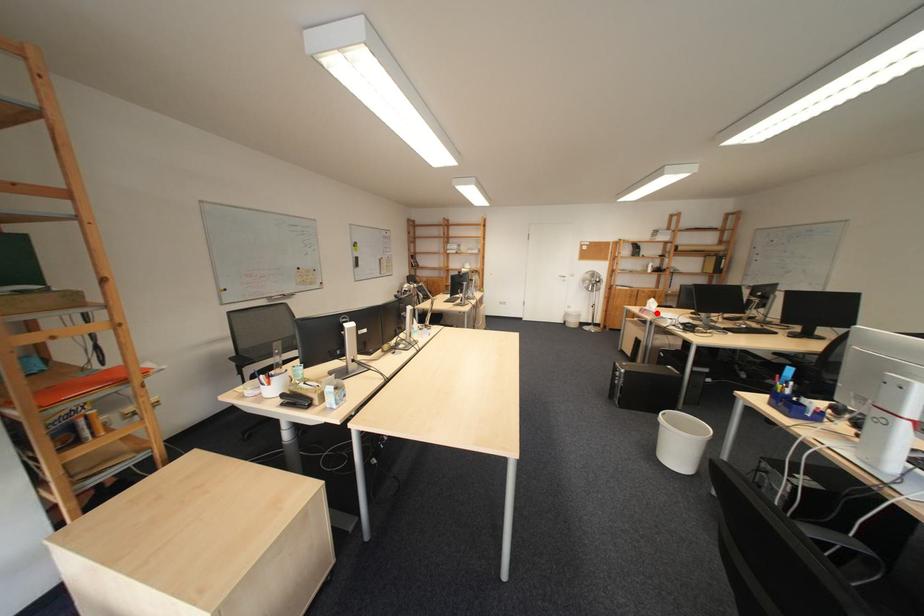
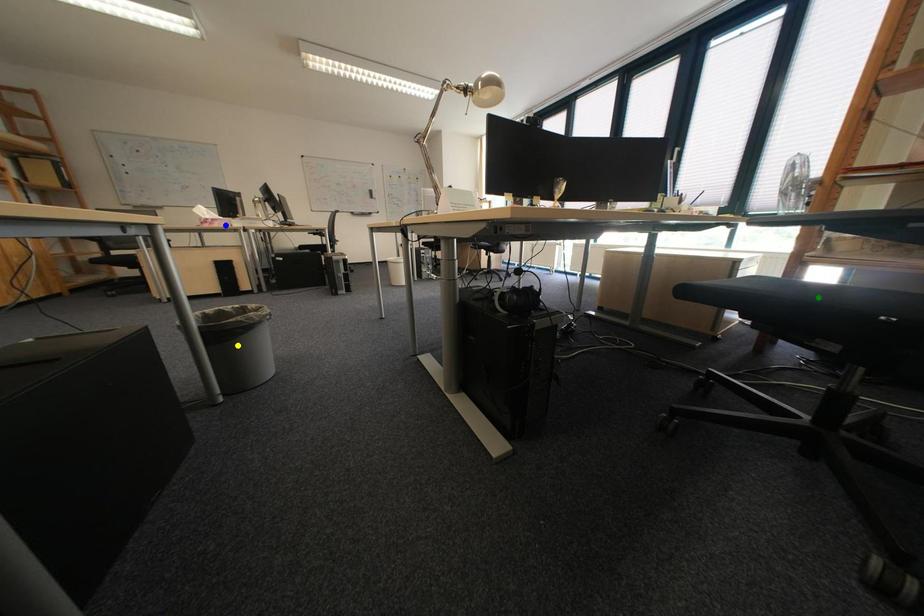
Question: I am providing you with two images of the same scene from different viewpoints. A red point is marked on the first image. You are given multiple points on the second image. Which spot in image 2 lines up with the point in image 1?

Choices:
 (A) yellow point
 (B) blue point
 (C) green point

Answer: (B)